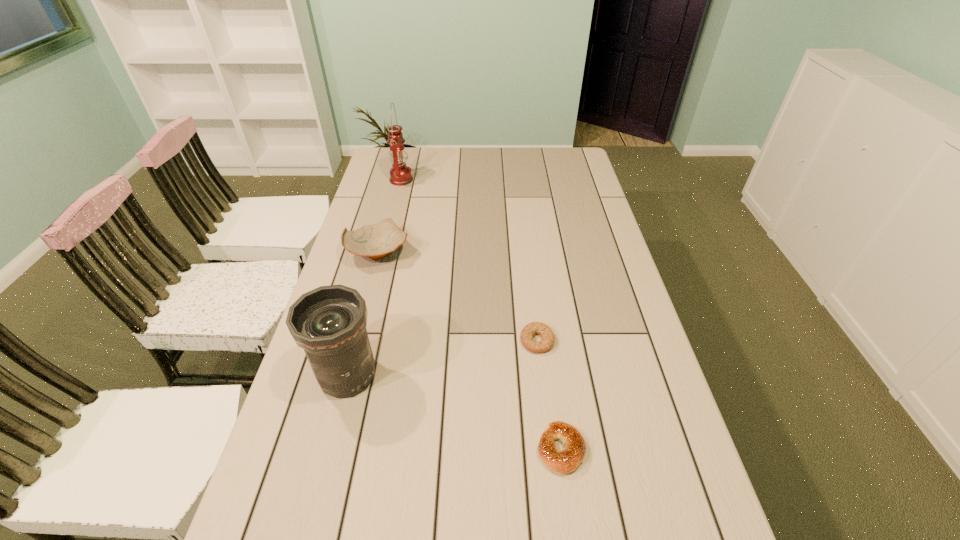
Find the location of a particular element. the tallest object is located at coordinates (400, 174).

The height and width of the screenshot is (540, 960). What are the coordinates of `the farthest object` in the screenshot? It's located at (400, 174).

Where is `telephoto lens`? This screenshot has height=540, width=960. telephoto lens is located at coordinates (329, 322).

Identify the location of the fourth nearest object. The width and height of the screenshot is (960, 540). (376, 241).

The width and height of the screenshot is (960, 540). I want to click on pottery, so click(376, 241).

Where is `the nearest object`? the nearest object is located at coordinates (565, 461).

The image size is (960, 540). What are the coordinates of `the farther bagel` in the screenshot? It's located at (530, 330).

Locate an element on the screen. free space located 0.060m on the right of the tallest object is located at coordinates [427, 180].

Find the location of a particular element. vacant area located 0.360m on the right of the telephoto lens is located at coordinates (524, 375).

Locate an element on the screen. free space located 0.140m on the front of the pottery is located at coordinates (364, 305).